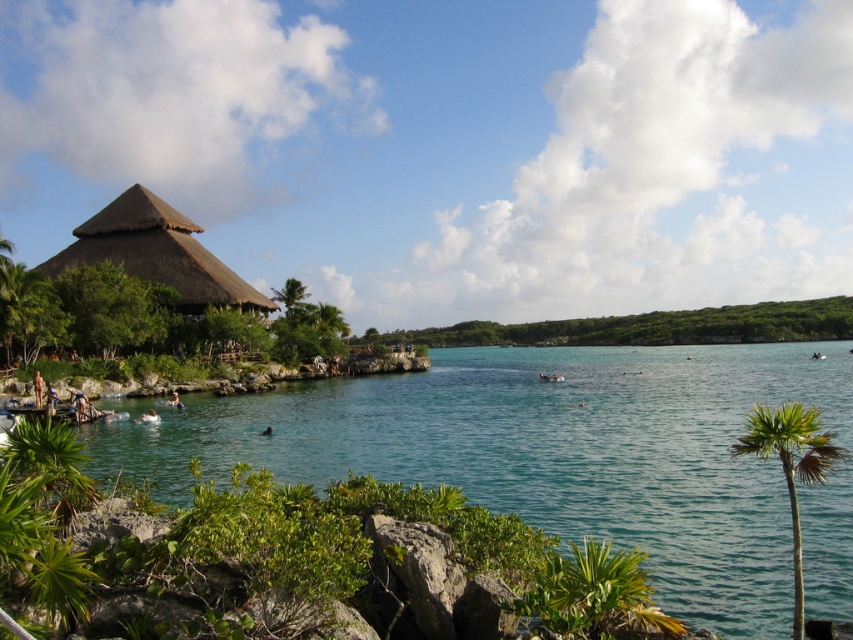
Question: Which object appears farthest from the camera in this image?

Choices:
 (A) brown thatch hut at left
 (B) green leafy vegetation at center
 (C) clear blue water at center
 (D) green leafy palm tree at lower right

Answer: (B)

Question: Is green leafy vegetation at center to the right of green leafy palm tree at lower right from the viewer's perspective?

Choices:
 (A) yes
 (B) no

Answer: (A)

Question: Is green leafy vegetation at center positioned before brown thatch hut at left?

Choices:
 (A) yes
 (B) no

Answer: (B)

Question: Is clear blue water at center smaller than brown thatch hut at left?

Choices:
 (A) yes
 (B) no

Answer: (B)

Question: Which object is positioned closest to the clear blue water at center?

Choices:
 (A) green leafy vegetation at center
 (B) brown thatch hut at left
 (C) green leafy palm tree at lower right

Answer: (B)

Question: Which of these objects is positioned closest to the green leafy palm tree at lower right?

Choices:
 (A) green leafy vegetation at center
 (B) brown thatch hut at left
 (C) clear blue water at center

Answer: (C)